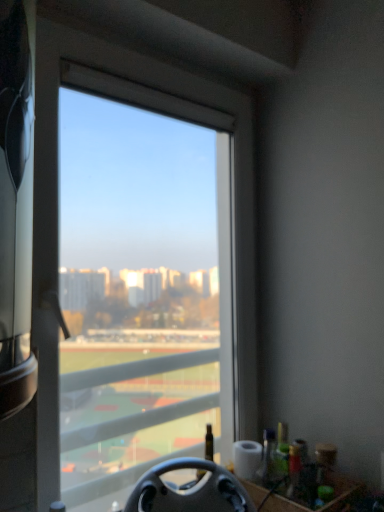
What do you see at coordinates (189, 490) in the screenshot? I see `black matte steering wheel at lower center` at bounding box center [189, 490].

What is the approximate height of black matte steering wheel at lower center?

The height of black matte steering wheel at lower center is 6.49 inches.

Measure the distance between black matte steering wheel at lower center and camera.

black matte steering wheel at lower center and camera are 37.47 inches apart.

Identify the location of black matte steering wheel at lower center. Image resolution: width=384 pixels, height=512 pixels. (189, 490).

What do you see at coordinates (57, 218) in the screenshot? I see `transparent glass window at center` at bounding box center [57, 218].

You are a GUI agent. You are given a task and a screenshot of the screen. Output one action in this format:
    pyautogui.click(x=<x>, y=<y>)
    Task: Click on the transparent glass window at center
    The image size is (384, 512).
    Given the screenshot: What is the action you would take?
    pyautogui.click(x=57, y=218)

Locate an element on the screen. black matte steering wheel at lower center is located at coordinates (189, 490).

Considering the positions of objects transparent glass window at center and black matte steering wheel at lower center in the image provided, who is more to the left, transparent glass window at center or black matte steering wheel at lower center?

Positioned to the left is transparent glass window at center.

Is the depth of transparent glass window at center greater than that of black matte steering wheel at lower center?

Yes, it is behind black matte steering wheel at lower center.

Which is closer to the camera, [256,376] or [220,493]?

Point [256,376] is positioned farther from the camera compared to point [220,493].

From the image's perspective, would you say transparent glass window at center is positioned over black matte steering wheel at lower center?

Indeed, from the image's perspective, transparent glass window at center is shown above black matte steering wheel at lower center.

Consider the image. From a real-world perspective, between transparent glass window at center and black matte steering wheel at lower center, who is vertically higher?

transparent glass window at center is physically above.

Which object is thinner, transparent glass window at center or black matte steering wheel at lower center?

With smaller width is transparent glass window at center.

Between transparent glass window at center and black matte steering wheel at lower center, which one has less height?

Standing shorter between the two is black matte steering wheel at lower center.

In the scene shown: Who is smaller, transparent glass window at center or black matte steering wheel at lower center?

Smaller between the two is black matte steering wheel at lower center.

Can we say transparent glass window at center lies outside black matte steering wheel at lower center?

That's correct, transparent glass window at center is outside of black matte steering wheel at lower center.

Is transparent glass window at center touching black matte steering wheel at lower center?

No, transparent glass window at center is not making contact with black matte steering wheel at lower center.

Is transparent glass window at center looking in the opposite direction of black matte steering wheel at lower center?

transparent glass window at center does not have its back to black matte steering wheel at lower center.

Image resolution: width=384 pixels, height=512 pixels. There is a black matte steering wheel at lower center. What are the coordinates of `window above it (from a real-world perspective)` in the screenshot? It's located at (57, 218).

Which is more to the left, black matte steering wheel at lower center or transparent glass window at center?

Positioned to the left is transparent glass window at center.

Is black matte steering wheel at lower center closer to camera compared to transparent glass window at center?

Yes, black matte steering wheel at lower center is closer to the viewer.

In the scene shown: Which point is more forward, (223, 495) or (55, 220)?

The point (223, 495) is closer to the camera.

In the scene shown: From the image's perspective, does black matte steering wheel at lower center appear higher than transparent glass window at center?

Actually, black matte steering wheel at lower center appears below transparent glass window at center in the image.

From a real-world perspective, does black matte steering wheel at lower center stand above transparent glass window at center?

No, from a real-world perspective, black matte steering wheel at lower center is not above transparent glass window at center.

Considering the sizes of black matte steering wheel at lower center and transparent glass window at center in the image, is black matte steering wheel at lower center wider or thinner than transparent glass window at center?

black matte steering wheel at lower center is wider than transparent glass window at center.

From their relative heights in the image, would you say black matte steering wheel at lower center is taller or shorter than transparent glass window at center?

Clearly, black matte steering wheel at lower center is shorter compared to transparent glass window at center.

Who is smaller, black matte steering wheel at lower center or transparent glass window at center?

black matte steering wheel at lower center is smaller.

Is black matte steering wheel at lower center inside or outside of transparent glass window at center?

black matte steering wheel at lower center is spatially situated outside transparent glass window at center.

Is there a large distance between black matte steering wheel at lower center and transparent glass window at center?

black matte steering wheel at lower center is near transparent glass window at center, not far away.

Is black matte steering wheel at lower center facing towards transparent glass window at center?

No, black matte steering wheel at lower center does not turn towards transparent glass window at center.

Find the location of a particular element. The width and height of the screenshot is (384, 512). window lying above the black matte steering wheel at lower center (from the image's perspective) is located at coordinates (57, 218).

Find the location of a particular element. Image resolution: width=384 pixels, height=512 pixels. steering wheel on the right of the transparent glass window at center is located at coordinates (189, 490).

Identify the location of window located behind the black matte steering wheel at lower center. 57,218.